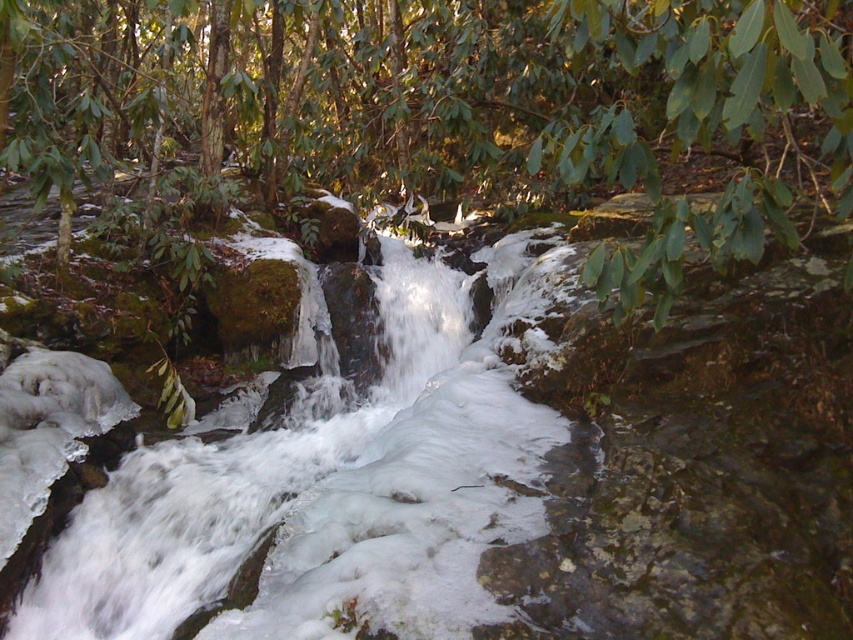
You are standing at the edge of the waterfall and want to take a photo of both the white frothy water at center and the green leafy tree at center. Which object should you focus on first if you want to capture both in a single frame?

You should focus on the green leafy tree at center first because the white frothy water at center is located below it, allowing both to be captured in the same frame by adjusting the camera angle to include both the upper tree and the lower waterfall.

You are standing at the edge of the waterfall and want to place a small decorative stone exactly at the center of the white frothy water at center. According to the image, what are the coordinates where you should place the stone?

The coordinates for the center of the white frothy water at center are at point [502,480]. Place the stone there.